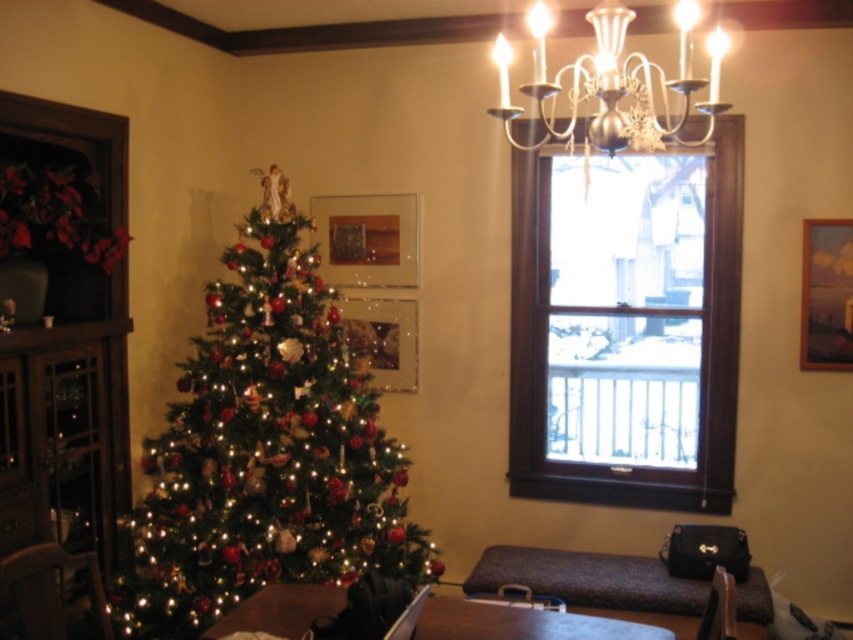
Does point (648, 355) come farther from viewer compared to point (613, 145)?

Yes.

Locate an element on the screen. The width and height of the screenshot is (853, 640). wooden frame at upper right is located at coordinates [625, 324].

Who is more forward, (x=718, y=186) or (x=683, y=104)?

Point (x=683, y=104) is in front.

Where is `wooden frame at upper right`? The height and width of the screenshot is (640, 853). wooden frame at upper right is located at coordinates (625, 324).

Does wooden table at lower center have a greater width compared to matte brown chair at lower left?

Indeed, wooden table at lower center has a greater width compared to matte brown chair at lower left.

Can you confirm if wooden table at lower center is thinner than matte brown chair at lower left?

No, wooden table at lower center is not thinner than matte brown chair at lower left.

Does point (560, 637) lie in front of point (48, 566)?

Yes, point (560, 637) is in front of point (48, 566).

The width and height of the screenshot is (853, 640). I want to click on wooden table at lower center, so click(521, 621).

What do you see at coordinates (612, 83) in the screenshot? This screenshot has width=853, height=640. I see `silver metallic chandelier at upper center` at bounding box center [612, 83].

Is point (718, 100) farther from camera compared to point (717, 576)?

No, (718, 100) is in front of (717, 576).

Which is in front, point (502, 122) or point (723, 580)?

Point (723, 580) is in front.

Where is `silver metallic chandelier at upper center`? The height and width of the screenshot is (640, 853). silver metallic chandelier at upper center is located at coordinates (612, 83).